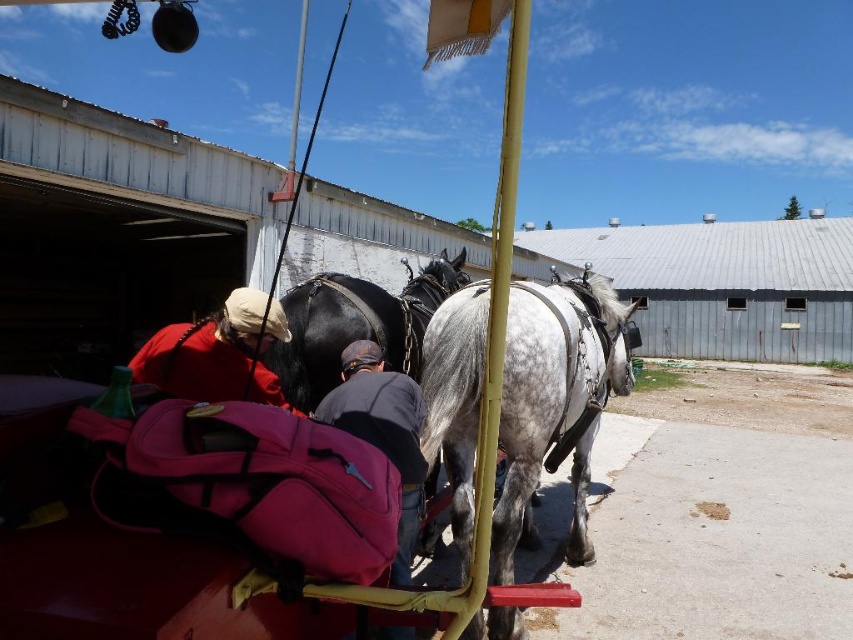
Question: Can you confirm if speckled white horse at center is wider than matte red jacket at upper left?

Choices:
 (A) yes
 (B) no

Answer: (A)

Question: Which of these objects is positioned closest to the speckled white horse at center?

Choices:
 (A) black glossy horse at center
 (B) matte red jacket at upper left

Answer: (A)

Question: Does speckled white horse at center lie behind dark gray fabric at center?

Choices:
 (A) yes
 (B) no

Answer: (B)

Question: Which object is closer to the camera taking this photo?

Choices:
 (A) black glossy horse at center
 (B) matte red jacket at upper left
 (C) speckled white horse at center

Answer: (C)

Question: Can you confirm if speckled white horse at center is thinner than matte red jacket at upper left?

Choices:
 (A) no
 (B) yes

Answer: (A)

Question: Which object is closer to the camera taking this photo?

Choices:
 (A) speckled white horse at center
 (B) black glossy horse at center
 (C) dark gray fabric at center
 (D) matte red jacket at upper left

Answer: (A)